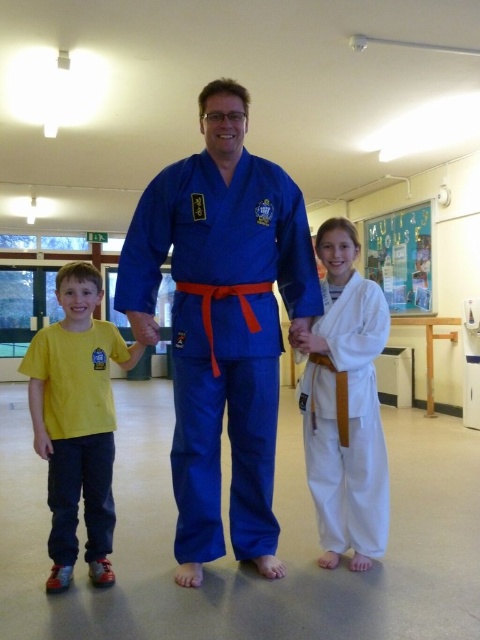
You are a new student entering the dojo and see both the blue fabric karate uniform at center and the white cotton karate uniform at center. Which one is closer to you?

The blue fabric karate uniform at center is closer to you because it is in front of the white cotton karate uniform at center.